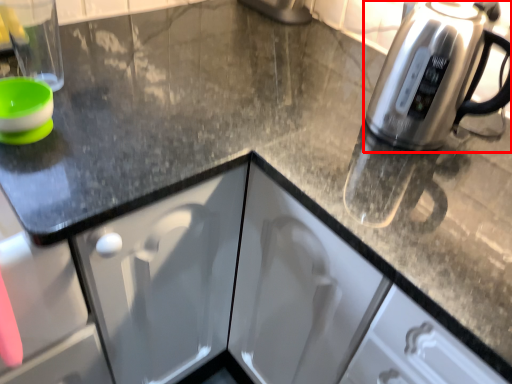
Question: From the image's perspective, considering the relative positions of kettle (annotated by the red box) and appliance in the image provided, where is kettle (annotated by the red box) located with respect to the staircase?

Choices:
 (A) above
 (B) below

Answer: (B)